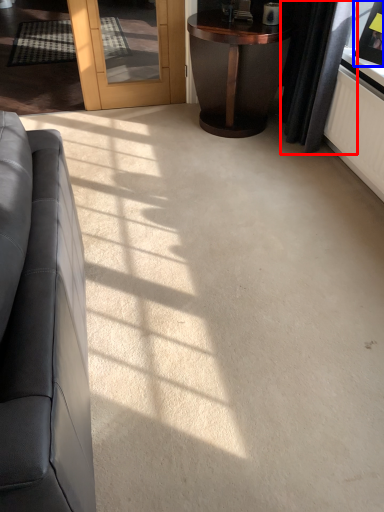
Question: Which object is further to the camera taking this photo, curtain (highlighted by a red box) or picture frame (highlighted by a blue box)?

Choices:
 (A) curtain
 (B) picture frame

Answer: (A)